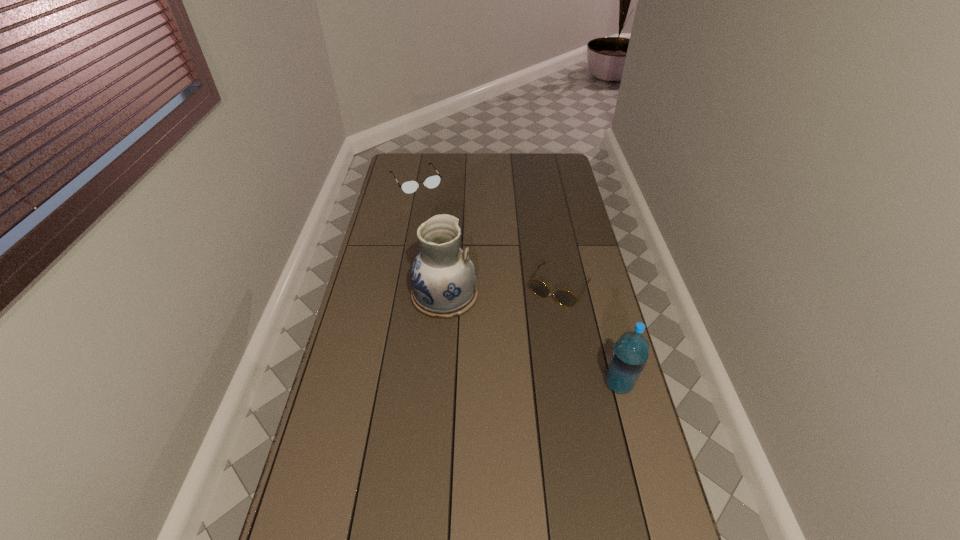
Locate an element on the screen. The width and height of the screenshot is (960, 540). vacant space on the desktop that is between the pottery and the second tallest object and is positioned on the lenses of the farthest object is located at coordinates (504, 325).

Find the location of a particular element. The image size is (960, 540). vacant space on the desktop that is between the pottery and the water bottle and is positioned on the lenses of the sunglasses is located at coordinates (529, 338).